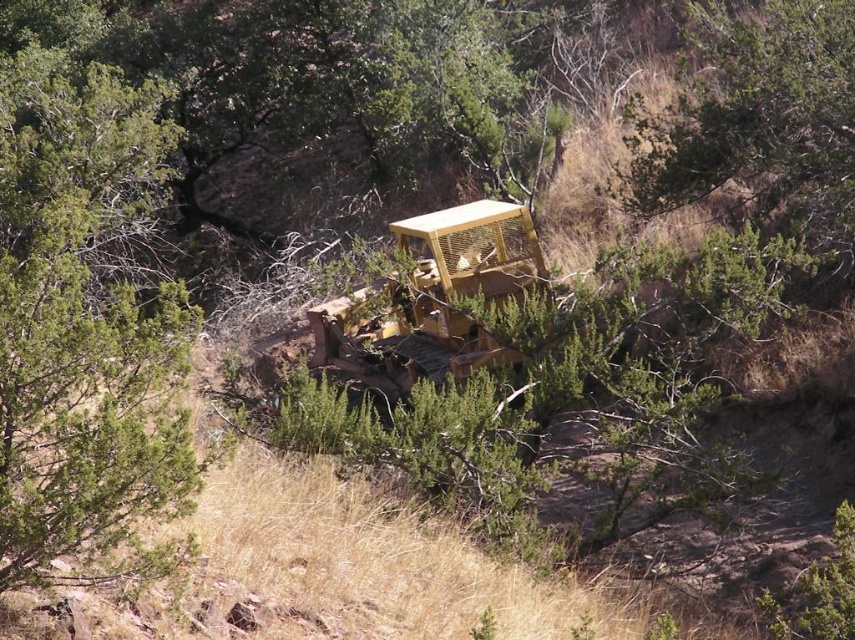
Is green needle-like foliage at center below yellow metallic tractor at center?

No, green needle-like foliage at center is not below yellow metallic tractor at center.

Does point (824, 141) come in front of point (500, 221)?

Yes, it is.

This screenshot has width=855, height=640. I want to click on green needle-like foliage at center, so click(759, 122).

Where is `green needle-like foliage at center`? green needle-like foliage at center is located at coordinates (759, 122).

Does green leafy tree at center appear on the right side of green needle-like foliage at center?

In fact, green leafy tree at center is to the left of green needle-like foliage at center.

Which is more to the right, green leafy tree at center or green needle-like foliage at center?

green needle-like foliage at center is more to the right.

Locate an element on the screen. green leafy tree at center is located at coordinates (83, 317).

Locate an element on the screen. The height and width of the screenshot is (640, 855). green leafy tree at center is located at coordinates (83, 317).

Is green leafy tree at center bigger than yellow metallic tractor at center?

Yes.

Between green leafy tree at center and yellow metallic tractor at center, which one has less height?

yellow metallic tractor at center

Measure the distance between green leafy tree at center and camera.

A distance of 4.64 meters exists between green leafy tree at center and camera.

At what (x,y) coordinates should I click in order to perform the action: click on green leafy tree at center. Please return your answer as a coordinate pair (x, y). The width and height of the screenshot is (855, 640). Looking at the image, I should click on (83, 317).